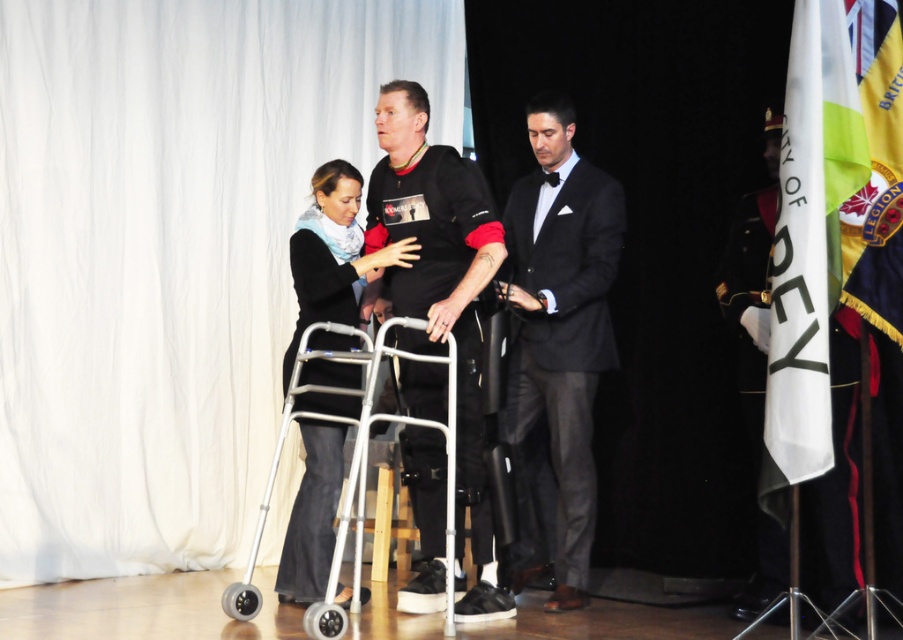
Question: Considering the relative positions of white matte curtain at upper left and black fabric jacket at center in the image provided, where is white matte curtain at upper left located with respect to black fabric jacket at center?

Choices:
 (A) right
 (B) left

Answer: (B)

Question: Which of the following is the closest to the observer?

Choices:
 (A) gold/yellow fabric flag at right
 (B) white matte curtain at upper left

Answer: (A)

Question: Estimate the real-world distances between objects in this image. Which object is closer to the gold/yellow fabric flag at right?

Choices:
 (A) black matte walker at center
 (B) white matte curtain at upper left
 (C) black fabric jacket at center
 (D) shiny black suit at center

Answer: (D)

Question: Which point is closer to the camera?

Choices:
 (A) black fabric jacket at center
 (B) white matte curtain at upper left

Answer: (A)

Question: Considering the relative positions of black matte walker at center and shiny black suit at center in the image provided, where is black matte walker at center located with respect to shiny black suit at center?

Choices:
 (A) left
 (B) right

Answer: (A)

Question: Can you confirm if white matte curtain at upper left is positioned above black fabric jacket at center?

Choices:
 (A) yes
 (B) no

Answer: (A)